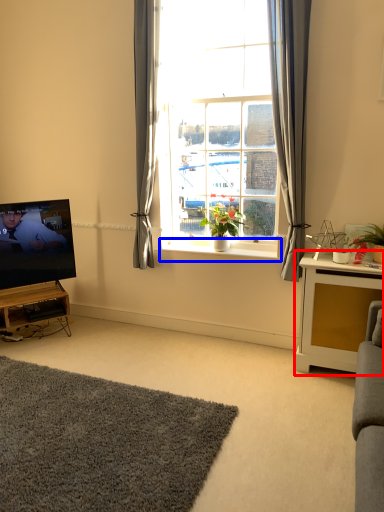
Question: Which object appears farthest to the camera in this image, table (highlighted by a red box) or window sill (highlighted by a blue box)?

Choices:
 (A) table
 (B) window sill

Answer: (B)